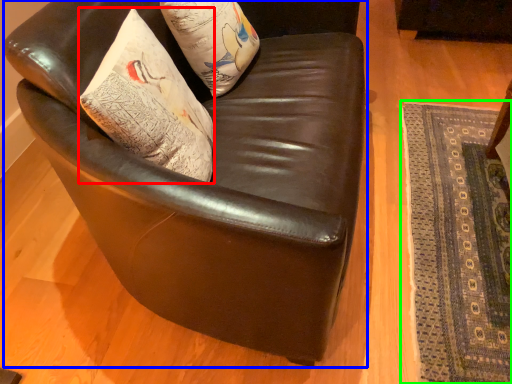
Question: Estimate the real-world distances between objects in this image. Which object is farther from throw pillow (highlighted by a red box), chair (highlighted by a blue box) or mat (highlighted by a green box)?

Choices:
 (A) chair
 (B) mat

Answer: (B)